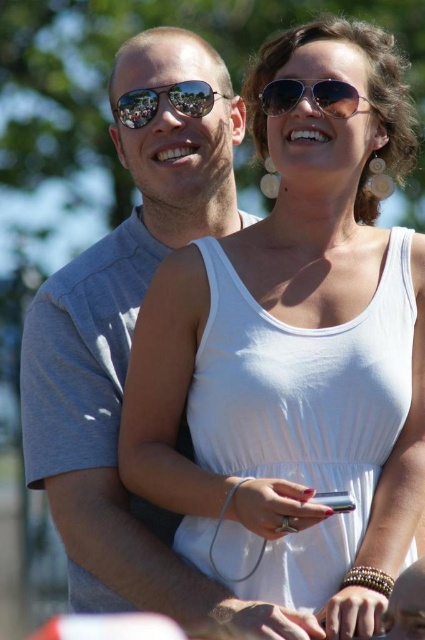
Question: Which of the following is the closest to the observer?

Choices:
 (A) white fabric dress at center
 (B) metallic silver phone at lower center

Answer: (A)

Question: Among these points, which one is nearest to the camera?

Choices:
 (A) (187, 97)
 (B) (329, 506)
 (C) (322, 100)
 (D) (201, 388)

Answer: (B)

Question: Which point is farther to the camera?

Choices:
 (A) shiny aviator sunglasses at upper center
 (B) shiny reflective sunglasses at upper center

Answer: (B)

Question: Is white fabric dress at center smaller than metallic silver phone at lower center?

Choices:
 (A) yes
 (B) no

Answer: (B)

Question: Considering the relative positions of white fabric dress at center and metallic silver phone at lower center in the image provided, where is white fabric dress at center located with respect to metallic silver phone at lower center?

Choices:
 (A) above
 (B) below

Answer: (A)

Question: Does white fabric dress at center appear over metallic silver phone at lower center?

Choices:
 (A) no
 (B) yes

Answer: (B)